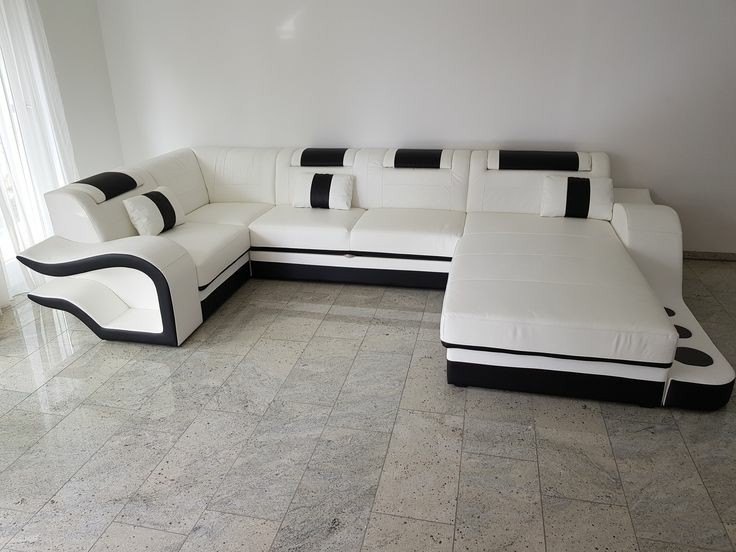
Identify the location of sofa. This screenshot has height=552, width=736. (431, 215).